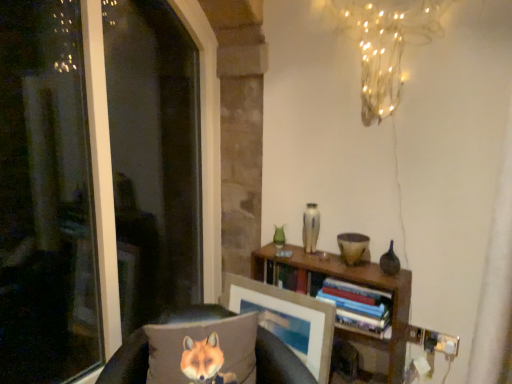
What do you see at coordinates (203, 350) in the screenshot? The image size is (512, 384). I see `textured gray pillow with fox print at lower left` at bounding box center [203, 350].

In order to face textured gray pillow with fox print at lower left, should I rotate leftwards or rightwards?

You should rotate left by 7.095 degrees.

Image resolution: width=512 pixels, height=384 pixels. What do you see at coordinates (54, 193) in the screenshot?
I see `transparent glass window at left` at bounding box center [54, 193].

What do you see at coordinates (386, 44) in the screenshot? I see `illuminated wire at upper center` at bounding box center [386, 44].

Locate an element on the screen. hardcover books at center is located at coordinates (358, 307).

Would you say transparent glass window at left is inside or outside matte wooden picture frame at center?

transparent glass window at left exists outside the volume of matte wooden picture frame at center.

Who is smaller, transparent glass window at left or matte wooden picture frame at center?

matte wooden picture frame at center is smaller.

You are a GUI agent. You are given a task and a screenshot of the screen. Output one action in this format:
    pyautogui.click(x=<x>, y=<y>)
    Task: Click on the picture frame that appears on the right of transparent glass window at left
    
    Given the screenshot: What is the action you would take?
    pyautogui.click(x=288, y=319)

Does matte wooden picture frame at center turn towards hardcover books at center?

No, matte wooden picture frame at center is not facing towards hardcover books at center.

Can you tell me how much matte wooden picture frame at center and hardcover books at center differ in facing direction?

The angular difference between matte wooden picture frame at center and hardcover books at center is 0.271 degrees.

Is matte wooden picture frame at center to the right of hardcover books at center from the viewer's perspective?

No.

Image resolution: width=512 pixels, height=384 pixels. I want to click on picture frame below the hardcover books at center (from a real-world perspective), so click(x=288, y=319).

Which is more to the left, illuminated wire at upper center or transparent glass window at left?

From the viewer's perspective, transparent glass window at left appears more on the left side.

From the image's perspective, which one is positioned higher, illuminated wire at upper center or transparent glass window at left?

illuminated wire at upper center.

I want to click on lamp behind the transparent glass window at left, so click(x=386, y=44).

How distant is illuminated wire at upper center from transparent glass window at left?

illuminated wire at upper center is 2.00 meters from transparent glass window at left.

Is brown fabric pillow at lower left positioned with its back to illuminated wire at upper center?

No.

Does point (139, 381) come behind point (389, 68)?

No, it is not.

Locate an element on the screen. lamp that appears above the brown fabric pillow at lower left (from the image's perspective) is located at coordinates (386, 44).

Would you say brown fabric pillow at lower left is to the left or to the right of illuminated wire at upper center in the picture?

brown fabric pillow at lower left is to the left of illuminated wire at upper center.

Is wooden bookshelf at center oriented away from textured gray pillow with fox print at lower left?

No, wooden bookshelf at center is not facing the opposite direction of textured gray pillow with fox print at lower left.

Can you see wooden bookshelf at center touching textured gray pillow with fox print at lower left?

No.

Is point (262, 277) closer or farther from the camera than point (162, 331)?

Point (262, 277).

Is wooden bookshelf at center positioned before textured gray pillow with fox print at lower left?

That is False.

Could you tell me if matte wooden picture frame at center is turned towards wooden bookshelf at center?

No, matte wooden picture frame at center is not oriented towards wooden bookshelf at center.

Does matte wooden picture frame at center lie in front of wooden bookshelf at center?

No, matte wooden picture frame at center is further to the viewer.

Is matte wooden picture frame at center placed right next to wooden bookshelf at center?

No, matte wooden picture frame at center is not beside wooden bookshelf at center.

From the image's perspective, which object appears higher, matte wooden picture frame at center or wooden bookshelf at center?

matte wooden picture frame at center, from the image's perspective.

The width and height of the screenshot is (512, 384). In order to click on picture frame above the brown fabric pillow at lower left (from the image's perspective) in this screenshot , I will do `click(288, 319)`.

Is matte wooden picture frame at center bigger than brown fabric pillow at lower left?

No, matte wooden picture frame at center is not bigger than brown fabric pillow at lower left.

Considering the sizes of matte wooden picture frame at center and brown fabric pillow at lower left in the image, is matte wooden picture frame at center taller or shorter than brown fabric pillow at lower left?

Considering their sizes, matte wooden picture frame at center has less height than brown fabric pillow at lower left.

Which of these two, matte wooden picture frame at center or brown fabric pillow at lower left, is thinner?

matte wooden picture frame at center.

Locate an element on the screen. window screen above the matte wooden picture frame at center (from the image's perspective) is located at coordinates (54, 193).

There is a matte wooden picture frame at center. Where is `book above it (from a real-world perspective)`? book above it (from a real-world perspective) is located at coordinates (x=358, y=307).

From the image, which object appears to be nearer to textured gray pillow with fox print at lower left, transparent glass window at left or brown fabric pillow at lower left?

brown fabric pillow at lower left.

Considering their positions, is hardcover books at center positioned closer to matte wooden picture frame at center than textured gray pillow with fox print at lower left?

hardcover books at center lies closer to matte wooden picture frame at center than the other object.

Which object lies further to the anchor point illuminated wire at upper center, wooden bookshelf at center or textured gray pillow with fox print at lower left?

textured gray pillow with fox print at lower left is positioned further to the anchor illuminated wire at upper center.

Looking at the image, which one is located further to textured gray pillow with fox print at lower left, matte wooden picture frame at center or illuminated wire at upper center?

illuminated wire at upper center.

Considering their positions, is hardcover books at center positioned further to brown fabric pillow at lower left than wooden bookshelf at center?

hardcover books at center.

Estimate the real-world distances between objects in this image. Which object is closer to wooden bookshelf at center, hardcover books at center or illuminated wire at upper center?

Based on the image, hardcover books at center appears to be nearer to wooden bookshelf at center.

Estimate the real-world distances between objects in this image. Which object is further from transparent glass window at left, illuminated wire at upper center or brown fabric pillow at lower left?

illuminated wire at upper center lies further to transparent glass window at left than the other object.

In the scene shown: Which object lies nearer to the anchor point brown fabric pillow at lower left, wooden bookshelf at center or hardcover books at center?

wooden bookshelf at center is closer to brown fabric pillow at lower left.

Find the location of a particular element. Image resolution: width=512 pixels, height=384 pixels. bookcase between transparent glass window at left and hardcover books at center from left to right is located at coordinates (352, 282).

At what (x,y) coordinates should I click in order to perform the action: click on furniture between transparent glass window at left and matte wooden picture frame at center in the horizontal direction. Please return your answer as a coordinate pair (x, y). This screenshot has width=512, height=384. Looking at the image, I should click on (278, 362).

The image size is (512, 384). Find the location of `pillow between transparent glass window at left and brown fabric pillow at lower left from top to bottom`. pillow between transparent glass window at left and brown fabric pillow at lower left from top to bottom is located at coordinates (203, 350).

This screenshot has width=512, height=384. In order to click on furniture between transparent glass window at left and wooden bookshelf at center in this screenshot , I will do `click(278, 362)`.